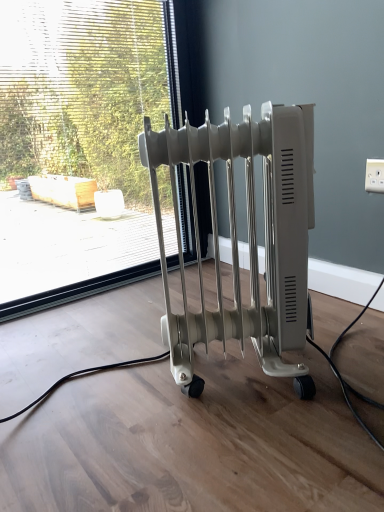
Question: From the image's perspective, is transparent glass window at center below white plastic radiator at center?

Choices:
 (A) yes
 (B) no

Answer: (B)

Question: Can we say transparent glass window at center lies outside white plastic radiator at center?

Choices:
 (A) no
 (B) yes

Answer: (B)

Question: Considering the relative sizes of transparent glass window at center and white plastic radiator at center in the image provided, is transparent glass window at center taller than white plastic radiator at center?

Choices:
 (A) yes
 (B) no

Answer: (A)

Question: Does transparent glass window at center have a smaller size compared to white plastic radiator at center?

Choices:
 (A) no
 (B) yes

Answer: (A)

Question: Is transparent glass window at center at the left side of white plastic radiator at center?

Choices:
 (A) no
 (B) yes

Answer: (B)

Question: From the image's perspective, is white plastic outlet at upper right above or below white plastic radiator at center?

Choices:
 (A) above
 (B) below

Answer: (A)

Question: From a real-world perspective, is white plastic outlet at upper right above or below white plastic radiator at center?

Choices:
 (A) above
 (B) below

Answer: (A)

Question: Based on their sizes in the image, would you say white plastic outlet at upper right is bigger or smaller than white plastic radiator at center?

Choices:
 (A) big
 (B) small

Answer: (B)

Question: Looking at their shapes, would you say white plastic outlet at upper right is wider or thinner than white plastic radiator at center?

Choices:
 (A) thin
 (B) wide

Answer: (A)

Question: Visually, is white plastic radiator at center positioned to the left or to the right of white plastic outlet at upper right?

Choices:
 (A) right
 (B) left

Answer: (B)

Question: Considering the positions of white plastic radiator at center and white plastic outlet at upper right in the image, is white plastic radiator at center wider or thinner than white plastic outlet at upper right?

Choices:
 (A) wide
 (B) thin

Answer: (A)

Question: From the image's perspective, relative to white plastic outlet at upper right, is white plastic radiator at center above or below?

Choices:
 (A) below
 (B) above

Answer: (A)

Question: Is white plastic radiator at center inside or outside of white plastic outlet at upper right?

Choices:
 (A) inside
 (B) outside

Answer: (B)

Question: From the image's perspective, is transparent glass window at center located above or below white plastic outlet at upper right?

Choices:
 (A) above
 (B) below

Answer: (A)

Question: Considering the positions of transparent glass window at center and white plastic outlet at upper right in the image, is transparent glass window at center wider or thinner than white plastic outlet at upper right?

Choices:
 (A) thin
 (B) wide

Answer: (B)